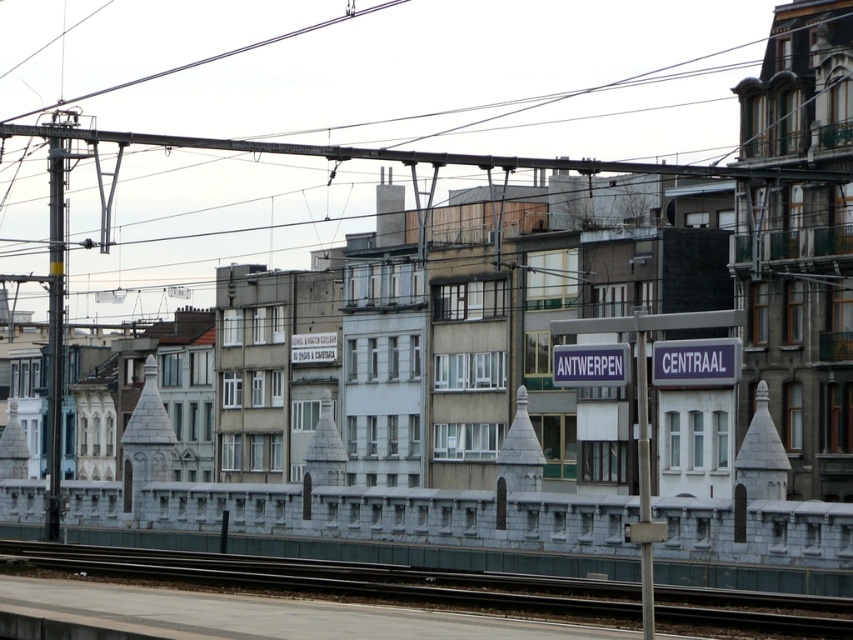
Question: Which object is closer to the camera taking this photo?

Choices:
 (A) black metal track at center
 (B) smooth concrete train at center
 (C) metallic gray pole at left

Answer: (A)

Question: Where is black metal track at center located in relation to metallic gray pole at left in the image?

Choices:
 (A) above
 (B) below

Answer: (B)

Question: Which of these objects is positioned farthest from the smooth concrete train at center?

Choices:
 (A) metallic gray pole at left
 (B) black metal track at center

Answer: (A)

Question: Does smooth concrete train at center have a lesser width compared to black metal track at center?

Choices:
 (A) yes
 (B) no

Answer: (B)

Question: Can you confirm if smooth concrete train at center is positioned to the left of black metal track at center?

Choices:
 (A) yes
 (B) no

Answer: (A)

Question: Estimate the real-world distances between objects in this image. Which object is closer to the metallic gray pole at left?

Choices:
 (A) black metal track at center
 (B) smooth concrete train at center

Answer: (B)